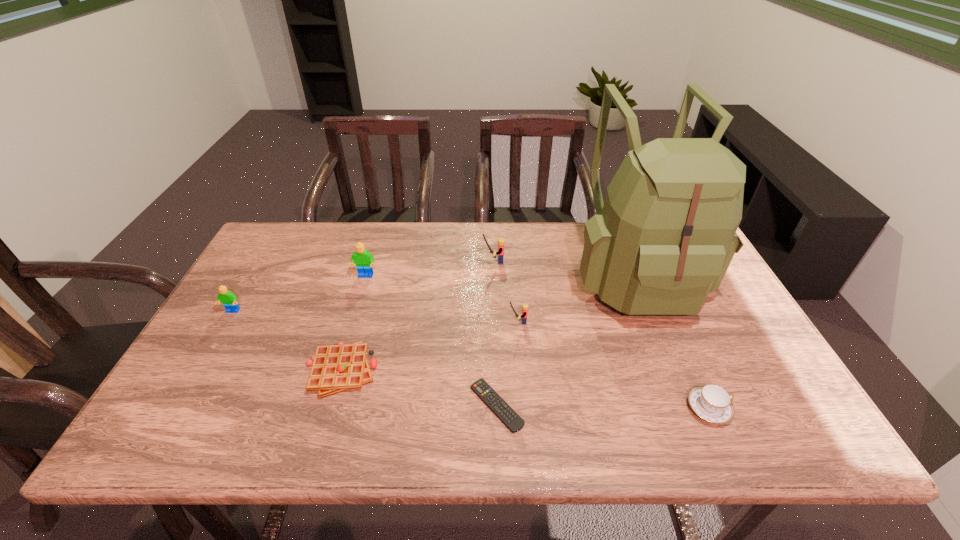
Where is `the closest Lego to the second shortest object`? The width and height of the screenshot is (960, 540). the closest Lego to the second shortest object is located at coordinates (363, 259).

Choose which Lego is the fourth nearest neighbor to the waffle. Please provide its 2D coordinates. Your answer should be formatted as a tuple, i.e. [(x, y)], where the tuple contains the x and y coordinates of a point satisfying the conditions above.

[(501, 241)]

Where is `blank area in the image that satisfies the following two spatial constraints: 1. on the face of the farther green Lego; 2. on the right side of the shortest object`? Image resolution: width=960 pixels, height=540 pixels. blank area in the image that satisfies the following two spatial constraints: 1. on the face of the farther green Lego; 2. on the right side of the shortest object is located at coordinates (327, 406).

Locate an element on the screen. vacant region that satisfies the following two spatial constraints: 1. on the front-facing side of the farther yellow Lego; 2. on the face of the third farthest Lego is located at coordinates pos(495,312).

This screenshot has width=960, height=540. Identify the location of vacant area that satisfies the following two spatial constraints: 1. on the face of the shortest object; 2. on the right side of the leftmost object. (178, 406).